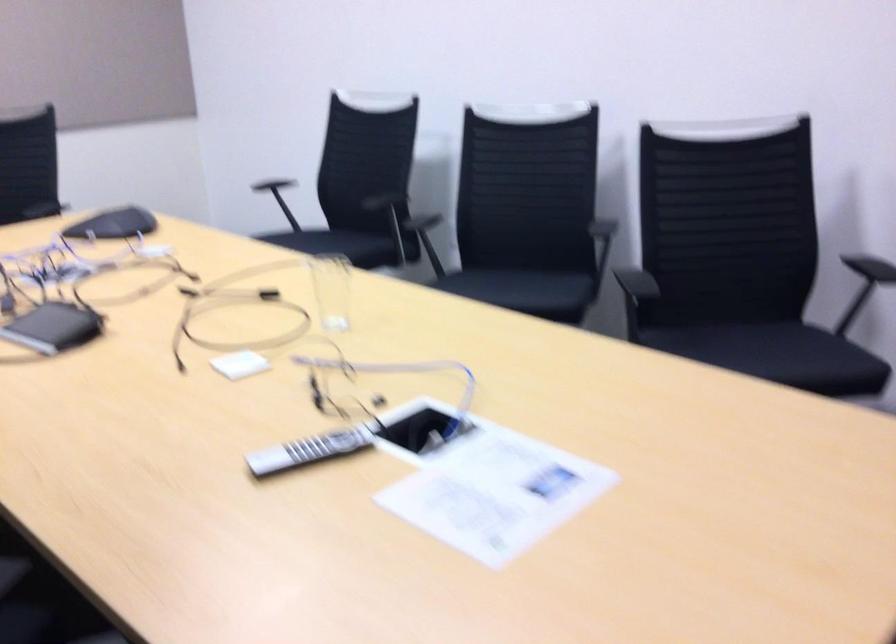
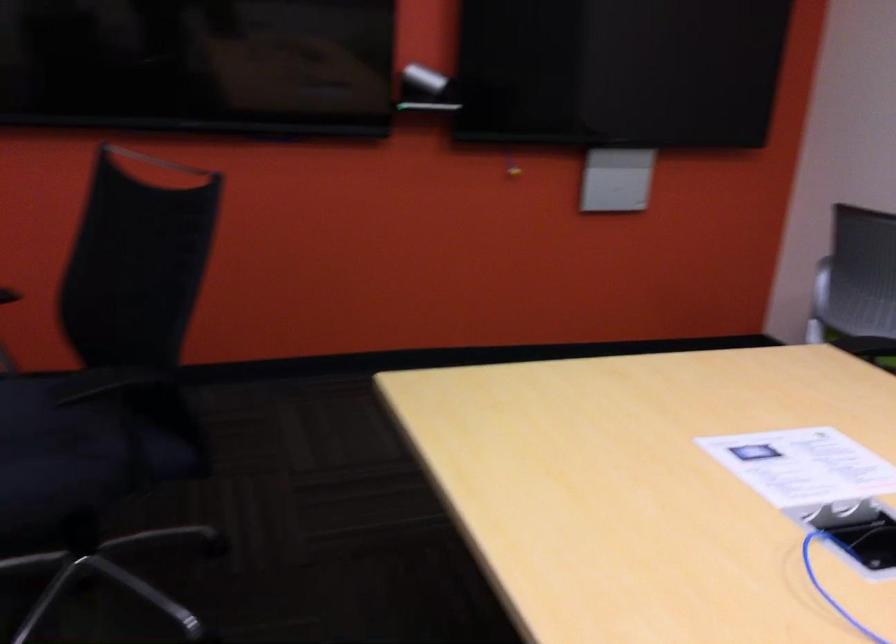
In the second image, find the point that corresponds to [409,480] in the first image.

(858, 532)